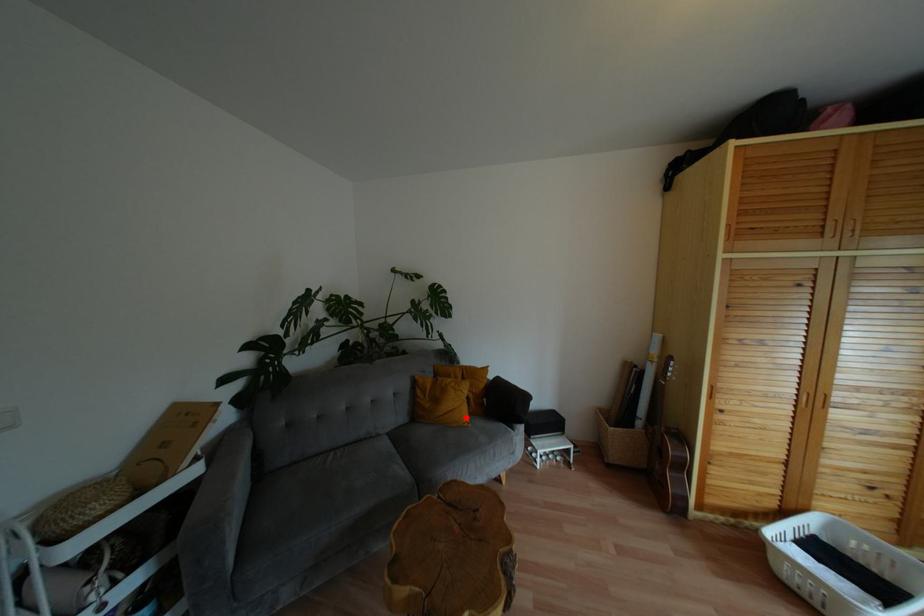
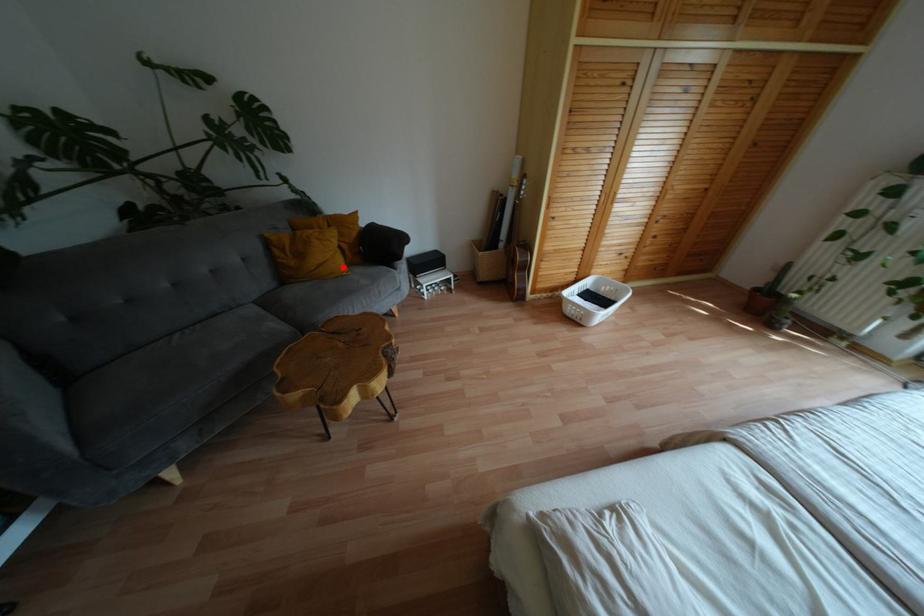
I am providing you with two images of the same scene from different viewpoints. A red point is marked on the first image and another point is marked on the second image. Is the marked point in image1 the same physical position as the marked point in image2?

Yes